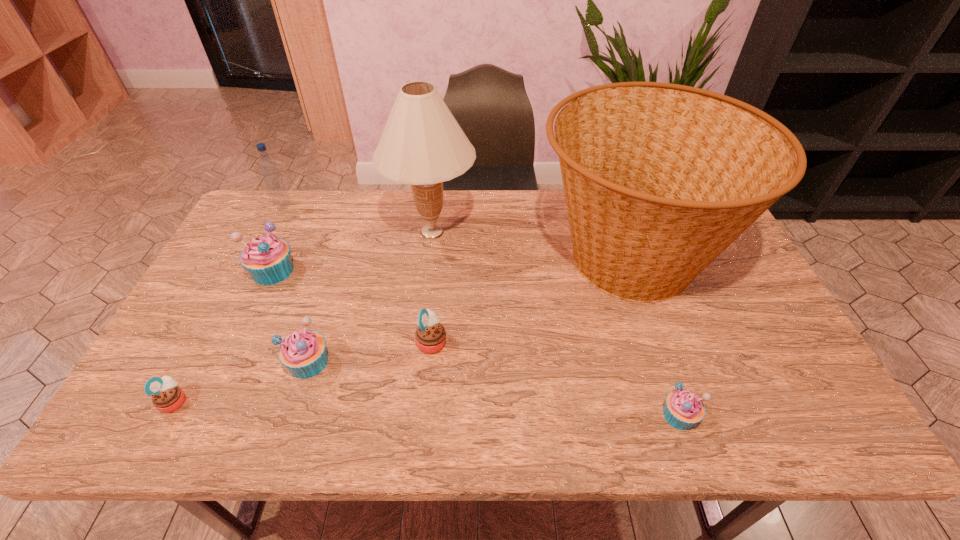
The height and width of the screenshot is (540, 960). I want to click on free space located 0.250m on the front-facing side of the smaller pink muffin, so pos(296,401).

In order to click on free spot located on the right of the smallest blue muffin in this screenshot , I will do `click(729, 415)`.

Identify the location of lampshade located at the far edge. This screenshot has height=540, width=960. (422, 144).

Identify the location of basket located at the far edge. The image size is (960, 540). (659, 179).

Identify the location of water bottle present at the far edge. This screenshot has width=960, height=540. (269, 169).

Identify the location of water bottle present at the left edge. The image size is (960, 540). (269, 169).

Locate an element on the screen. This screenshot has width=960, height=540. object present at the right edge is located at coordinates (659, 179).

The width and height of the screenshot is (960, 540). Find the location of `object that is at the far left corner`. object that is at the far left corner is located at coordinates (269, 169).

Find the location of a particular element. This screenshot has height=540, width=960. object that is at the near left corner is located at coordinates (167, 397).

Find the location of a particular element. Image resolution: width=960 pixels, height=540 pixels. object that is at the far right corner is located at coordinates (659, 179).